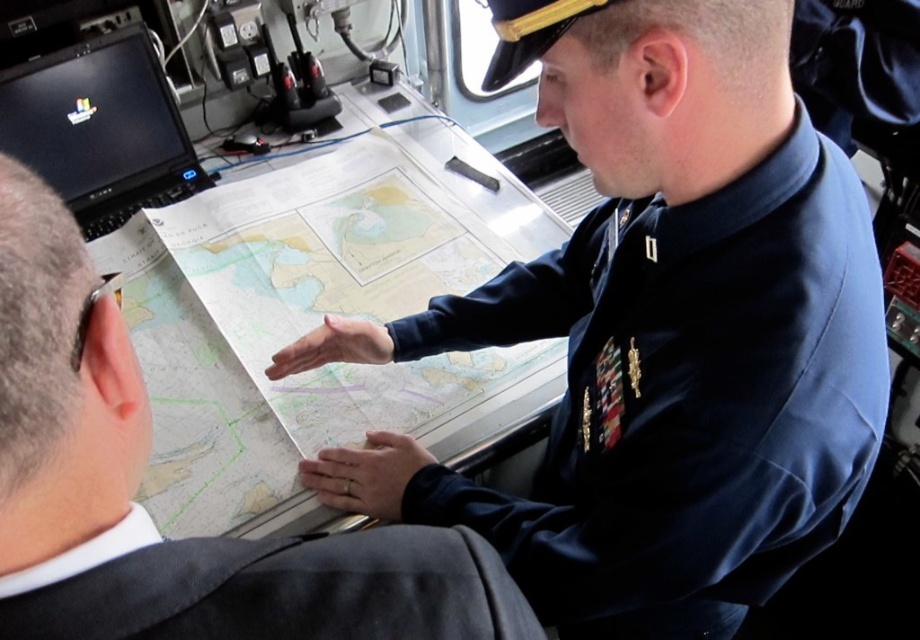
From the picture: You are a photographer positioned at the back of the room. You need to take a photo of the blue uniform at center and the black glossy laptop at upper left. Based on their positions, which object should you place closer to the left side of your camera frame?

The black glossy laptop at upper left should be placed closer to the left side of your camera frame because the blue uniform at center is to the right of it.

You are a photographer positioned at the center of the scene. You need to capture a photo that includes both the gray fabric suit at lower left and the black glossy laptop at upper left. Based on their heights, which object should be placed closer to the camera to ensure both are fully visible in the frame?

The gray fabric suit at lower left has a lesser height compared to the black glossy laptop at upper left. To ensure both are fully visible, the gray fabric suit at lower left should be placed closer to the camera since its smaller size requires it to be nearer for better visibility.

You are a photographer positioned at the back of the room. You want to take a clear photo of the black glossy laptop at upper left without the blue uniform at center blocking it. What should you do?

The blue uniform at center is in front of the black glossy laptop at upper left, so you should move to a position where the blue uniform at center is no longer between you and the black glossy laptop at upper left, such as moving to the side or adjusting your angle to avoid the obstruction.